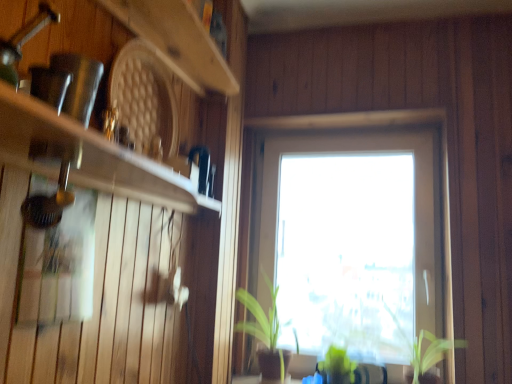
Question: Is transparent glass window at center closer to the viewer compared to green matte plant at center, which ranks as the third plant in right-to-left order?

Choices:
 (A) yes
 (B) no

Answer: (B)

Question: Considering the relative positions of transparent glass window at center and green matte plant at center, placed as the first plant when sorted from left to right, in the image provided, is transparent glass window at center to the left of green matte plant at center, placed as the first plant when sorted from left to right, from the viewer's perspective?

Choices:
 (A) yes
 (B) no

Answer: (B)

Question: Does transparent glass window at center have a larger size compared to green matte plant at center, placed as the first plant when sorted from left to right?

Choices:
 (A) no
 (B) yes

Answer: (A)

Question: Considering the relative sizes of transparent glass window at center and green matte plant at center, which ranks as the third plant in right-to-left order, in the image provided, is transparent glass window at center thinner than green matte plant at center, which ranks as the third plant in right-to-left order,?

Choices:
 (A) yes
 (B) no

Answer: (A)

Question: Can you see transparent glass window at center touching green matte plant at center, which ranks as the third plant in right-to-left order?

Choices:
 (A) yes
 (B) no

Answer: (B)

Question: Can we say transparent glass window at center lies outside green matte plant at center, placed as the first plant when sorted from left to right?

Choices:
 (A) no
 (B) yes

Answer: (B)

Question: Is wooden at upper left, which appears as the second shelf when ordered from the bottom, taller than matte white shelf at left, the first shelf in the bottom-to-top sequence?

Choices:
 (A) no
 (B) yes

Answer: (A)

Question: Is wooden at upper left, which appears as the second shelf when ordered from the bottom, thinner than matte white shelf at left, the first shelf in the bottom-to-top sequence?

Choices:
 (A) yes
 (B) no

Answer: (A)

Question: Is wooden at upper left, which appears as the second shelf when ordered from the bottom, with matte white shelf at left, the first shelf in the bottom-to-top sequence?

Choices:
 (A) no
 (B) yes

Answer: (A)

Question: Is wooden at upper left, which appears as the second shelf when ordered from the bottom, located outside matte white shelf at left, the 2th shelf positioned from the top?

Choices:
 (A) no
 (B) yes

Answer: (B)

Question: Could you tell me if wooden at upper left, which appears as the first shelf when viewed from the top, is turned towards matte white shelf at left, the first shelf in the bottom-to-top sequence?

Choices:
 (A) yes
 (B) no

Answer: (B)

Question: Can you confirm if wooden at upper left, which appears as the first shelf when viewed from the top, is positioned to the left of matte white shelf at left, the first shelf in the bottom-to-top sequence?

Choices:
 (A) no
 (B) yes

Answer: (A)

Question: Considering the relative sizes of wooden at upper left, which appears as the first shelf when viewed from the top, and green matte plant at center, placed as the first plant when sorted from left to right, in the image provided, is wooden at upper left, which appears as the first shelf when viewed from the top, wider than green matte plant at center, placed as the first plant when sorted from left to right,?

Choices:
 (A) yes
 (B) no

Answer: (B)